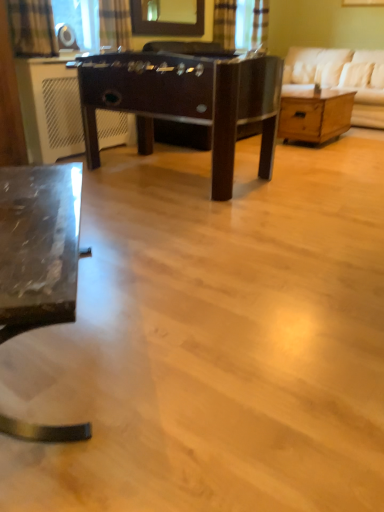
Find the location of a particular element. The image size is (384, 512). vacant region below dark brown wood foosball table at center, positioned as the first table in left-to-right order (from a real-world perspective) is located at coordinates (160, 178).